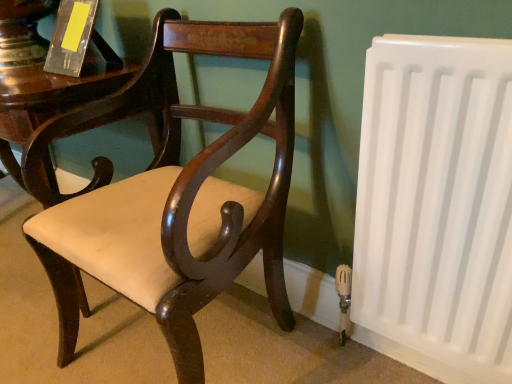
Locate an element on the screen. The image size is (512, 384). vacant space underneath white plastic radiator at right (from a real-world perspective) is located at coordinates (380, 365).